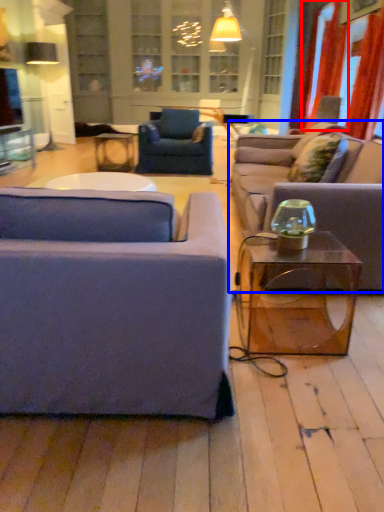
Question: Which object is closer to the camera taking this photo, curtain (highlighted by a red box) or studio couch (highlighted by a blue box)?

Choices:
 (A) curtain
 (B) studio couch

Answer: (B)